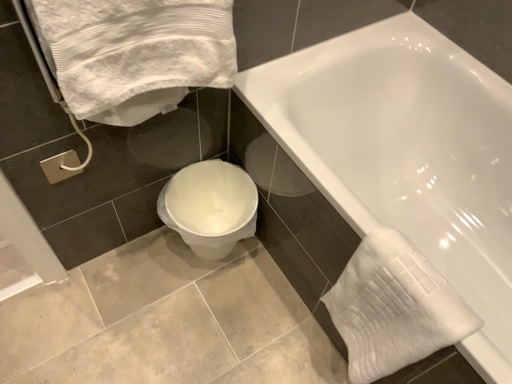
Question: Is white glossy bathtub at center wider than white textured towel at lower right, positioned as the 1th bath towel in bottom-to-top order?

Choices:
 (A) yes
 (B) no

Answer: (A)

Question: Is white glossy bathtub at center bigger than white textured towel at lower right, marked as the first bath towel in a right-to-left arrangement?

Choices:
 (A) yes
 (B) no

Answer: (A)

Question: From a real-world perspective, is white glossy bathtub at center physically above white textured towel at lower right, marked as the first bath towel in a right-to-left arrangement?

Choices:
 (A) no
 (B) yes

Answer: (A)

Question: From the image's perspective, would you say white glossy bathtub at center is positioned over white textured towel at lower right, positioned as the 1th bath towel in bottom-to-top order?

Choices:
 (A) no
 (B) yes

Answer: (B)

Question: Is white glossy bathtub at center taller than white textured towel at lower right, marked as the second bath towel in a left-to-right arrangement?

Choices:
 (A) yes
 (B) no

Answer: (A)

Question: From a real-world perspective, relative to white glossy bathtub at center, is white plastic toilet at lower center vertically above or below?

Choices:
 (A) below
 (B) above

Answer: (A)

Question: From the image's perspective, is white plastic toilet at lower center above or below white glossy bathtub at center?

Choices:
 (A) below
 (B) above

Answer: (A)

Question: Considering the relative positions of white plastic toilet at lower center and white glossy bathtub at center in the image provided, is white plastic toilet at lower center to the left or to the right of white glossy bathtub at center?

Choices:
 (A) left
 (B) right

Answer: (A)

Question: Is white plastic toilet at lower center spatially inside white glossy bathtub at center, or outside of it?

Choices:
 (A) inside
 (B) outside

Answer: (B)

Question: Is silver metallic towel bar at lower left bigger or smaller than white plastic toilet at lower center?

Choices:
 (A) big
 (B) small

Answer: (B)

Question: In terms of height, does silver metallic towel bar at lower left look taller or shorter compared to white plastic toilet at lower center?

Choices:
 (A) short
 (B) tall

Answer: (A)

Question: From the image's perspective, is silver metallic towel bar at lower left above or below white plastic toilet at lower center?

Choices:
 (A) above
 (B) below

Answer: (A)

Question: In the image, is silver metallic towel bar at lower left on the left side or the right side of white plastic toilet at lower center?

Choices:
 (A) right
 (B) left

Answer: (B)

Question: From a real-world perspective, is white glossy bathtub at center above or below white textured towel at upper left, the 2th bath towel when ordered from bottom to top?

Choices:
 (A) above
 (B) below

Answer: (B)

Question: Is white glossy bathtub at center wider or thinner than white textured towel at upper left, the second bath towel positioned from the right?

Choices:
 (A) thin
 (B) wide

Answer: (B)